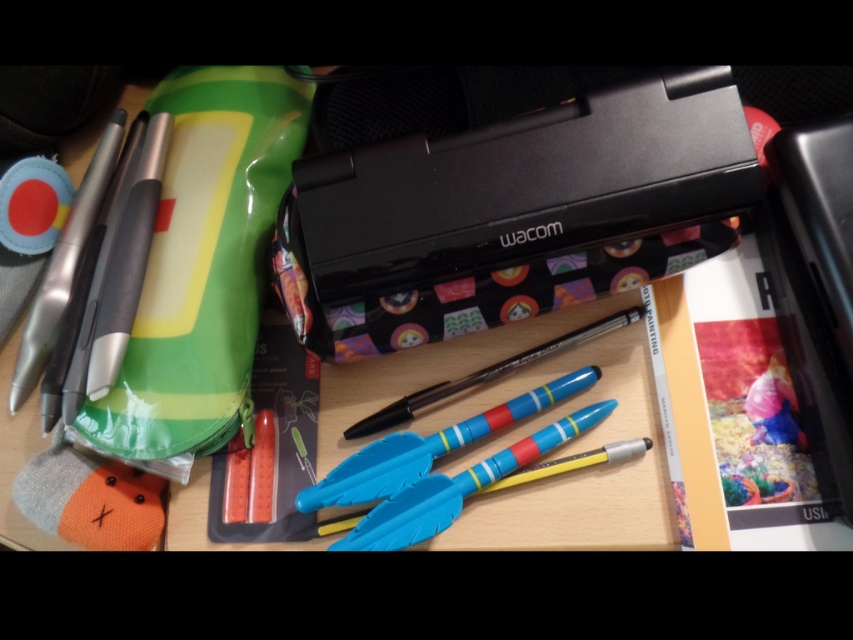
You are an artist trying to place a ruler between the matte plastic pens at center and the translucent plastic pen at center. Can you fit a ruler that is 4 centimeters long between them?

The distance between the matte plastic pens at center and the translucent plastic pen at center is 3.96 centimeters, so a ruler of 4 centimeters would not fit between them as it is slightly longer than the available space.

You are holding a 12 inch ruler and want to measure the distance between the point at coordinates point (660, 256) and the viewer. Can you determine if the distance is more than 2 feet?

The distance between point (660, 256) and the viewer is 27.92 inches, which is more than 24 inches. Therefore, the distance is more than 2 feet.

You are organizing the office supplies and need to place the matte plastic pens at center and the translucent plastic pen at center into a drawer. The drawer has a divider that separates the left and right compartments. Which side should you place each pen to match their positions in the image?

The matte plastic pens at center should be placed on the left compartment and the translucent plastic pen at center on the right compartment, as the matte plastic pens at center are to the left of the translucent plastic pen at center in the image.